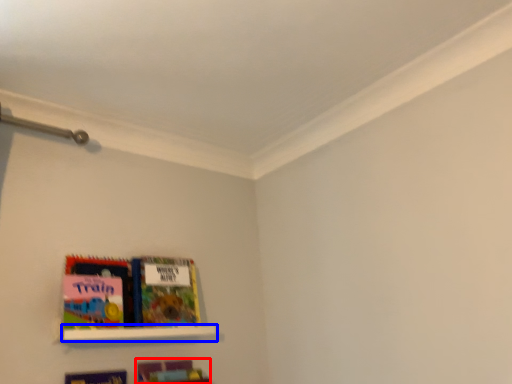
Question: Which object appears farthest to the camera in this image, book (highlighted by a red box) or shelf (highlighted by a blue box)?

Choices:
 (A) book
 (B) shelf

Answer: (A)